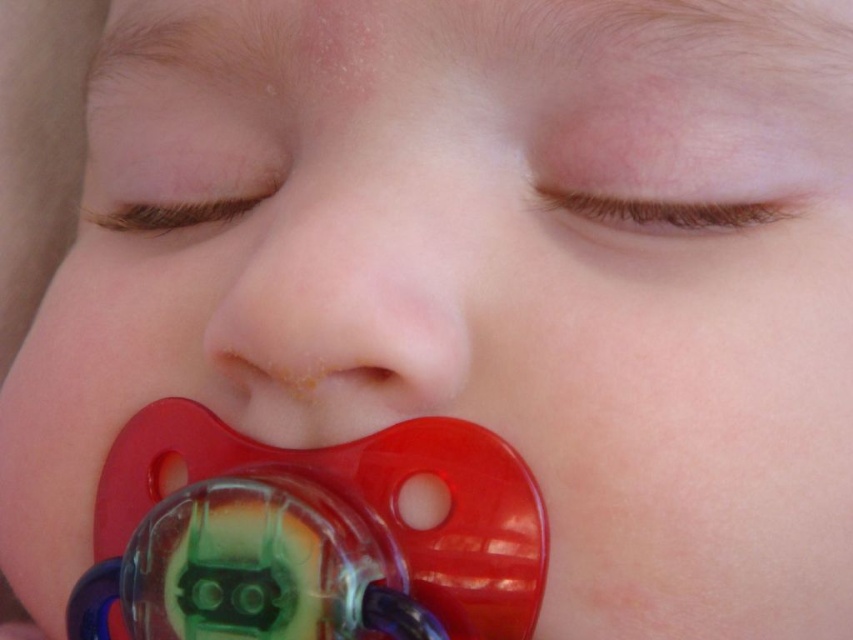
You are a parent holding your baby. The baby is lying on a changing table, and you want to check if the translucent plastic pacifier at lower center is within a safe distance to prevent choking. According to safety guidelines, the pacifier should be at least 6 inches away from the baby. Is the current distance safe?

The translucent plastic pacifier at lower center is 10.37 inches away from the viewer, which exceeds the minimum required 6 inches. Therefore, the distance is safe and complies with safety guidelines.

You are a photographer trying to capture a closeup of the baby. The camera is currently positioned 25.52 centimeters away from the smooth skin nose at center. If you want to focus on the baby without moving the camera, what should you adjust?

The camera is already positioned 25.52 centimeters away from the smooth skin nose at center. To focus without moving the camera, adjust the lens focus settings to ensure clarity on the baby.

Based on the scene description, which object is wider between the smooth skin nose at center and the translucent plastic pacifier at lower center?

The translucent plastic pacifier at lower center is wider than the smooth skin nose at center.